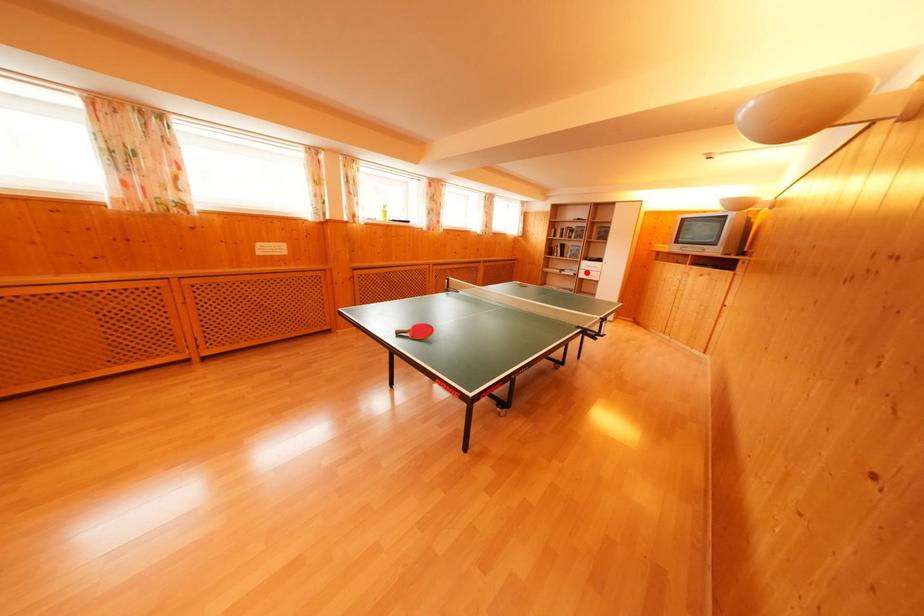
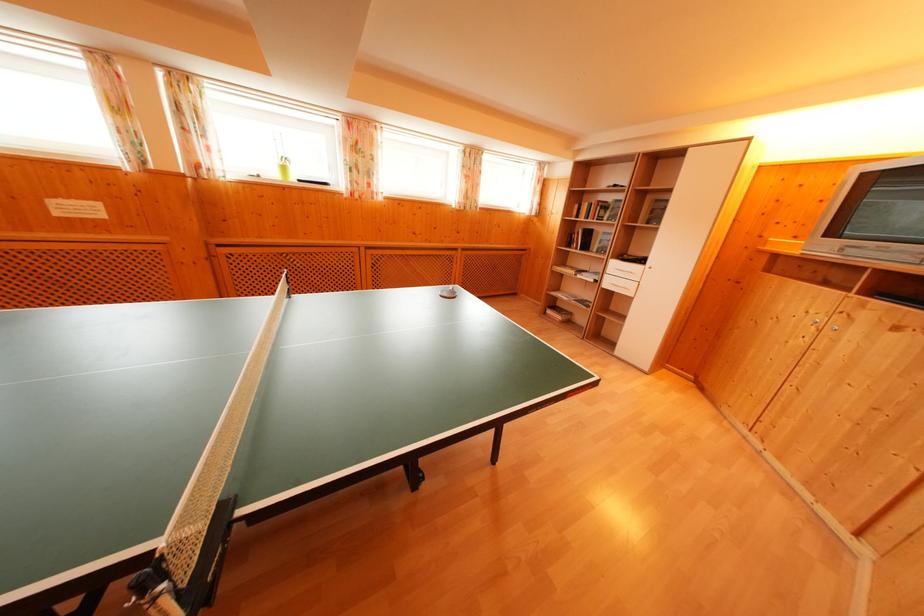
Question: I am providing you with two images of the same scene from different viewpoints. In image1, a red point is highlighted. Considering the same 3D point in image2, which of the following is correct?

Choices:
 (A) It is closer
 (B) It is farther

Answer: (B)